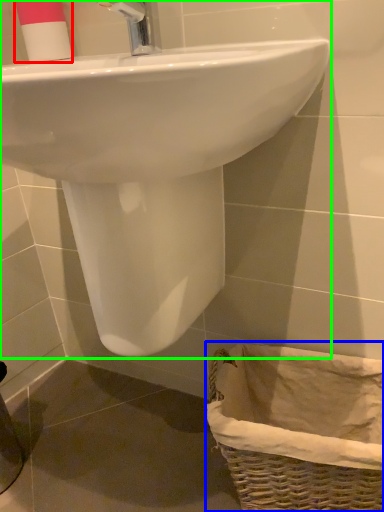
Question: Considering the real-world distances, which object is closest to toiletry (highlighted by a red box)? basket (highlighted by a blue box) or sink (highlighted by a green box).

Choices:
 (A) basket
 (B) sink

Answer: (B)